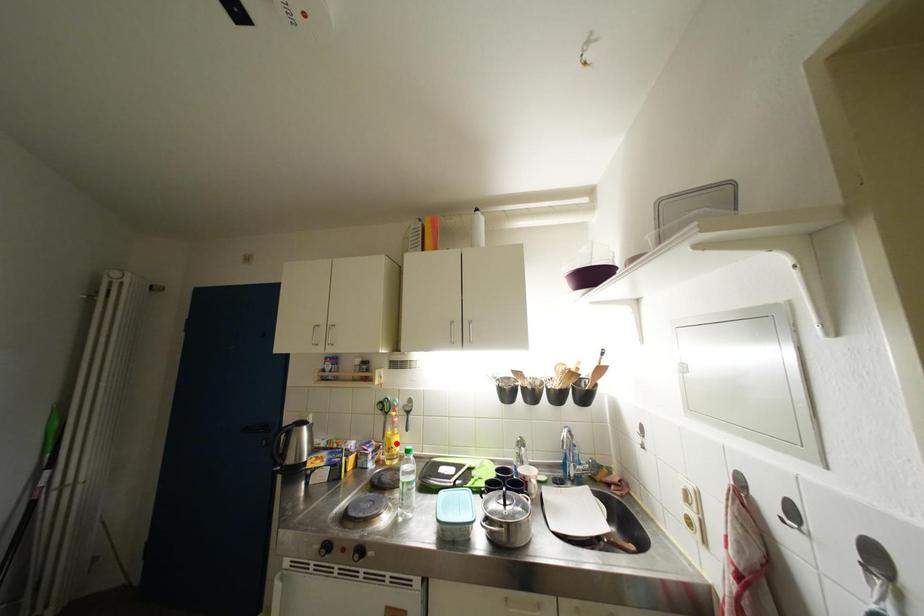
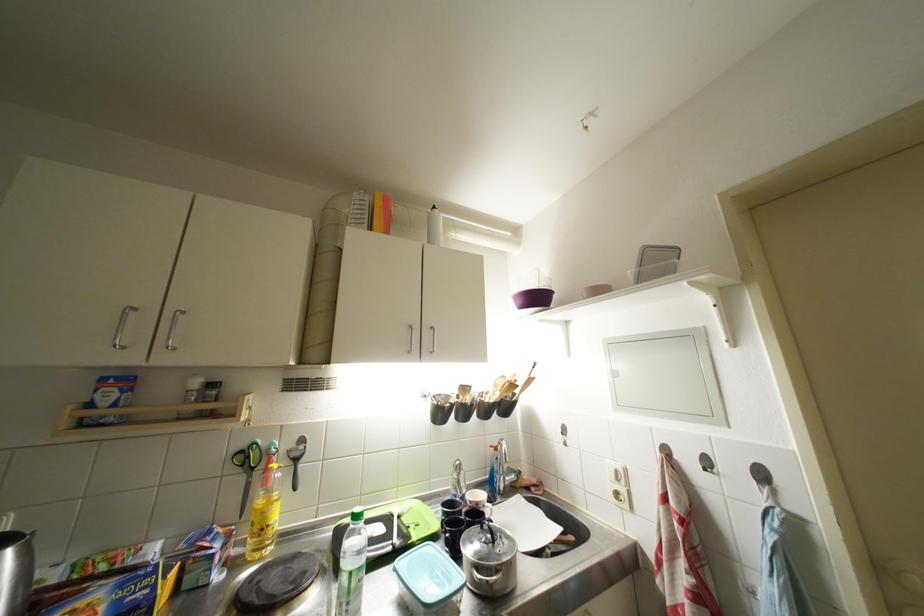
Locate, in the second image, the point that corresponds to the highlighted location in the first image.

(271, 517)